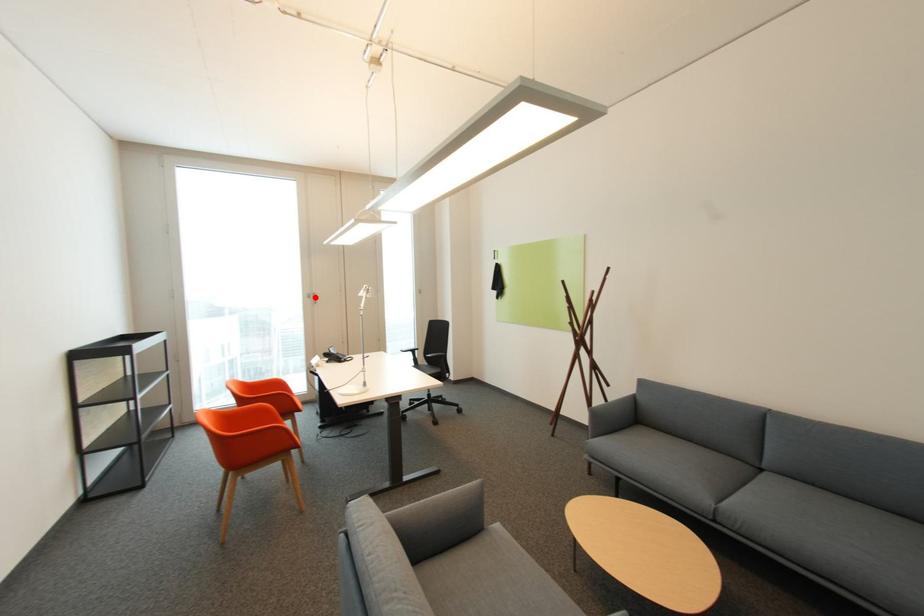
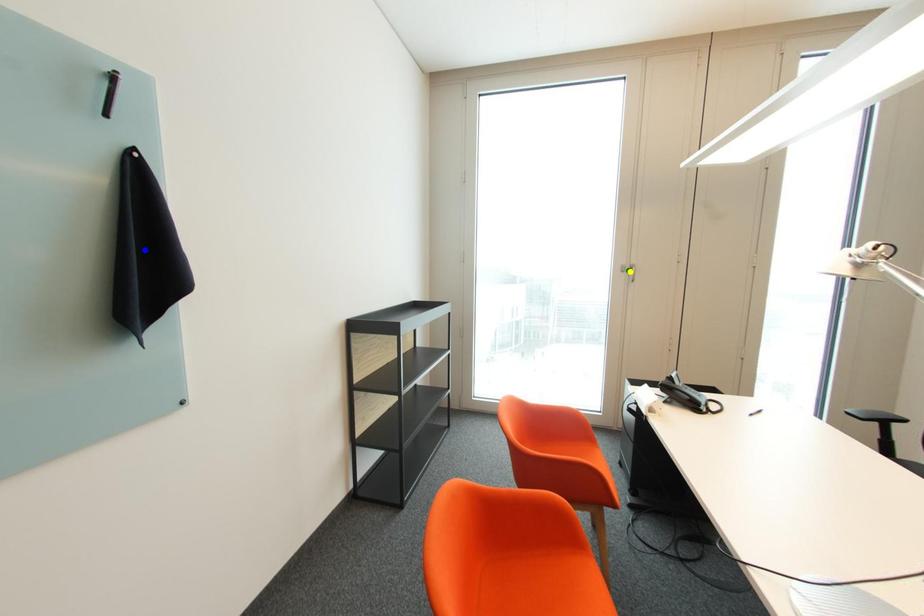
Question: I am providing you with two images of the same scene from different viewpoints. A red point is marked on the first image. You are given multiple points on the second image. Which mark in image 2 goes with the point in image 1?

Choices:
 (A) green point
 (B) blue point
 (C) yellow point

Answer: (C)